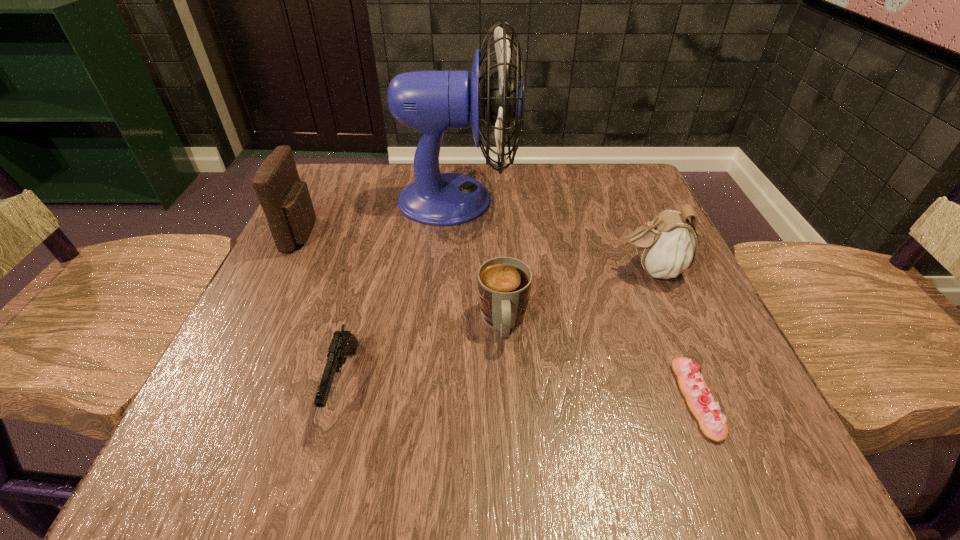
Find the location of a particular element. Image resolution: width=960 pixels, height=540 pixels. blank area at the near left corner is located at coordinates (221, 412).

Image resolution: width=960 pixels, height=540 pixels. In the image, there is a desktop. In order to click on free region at the far right corner in this screenshot , I will do `click(635, 204)`.

You are a GUI agent. You are given a task and a screenshot of the screen. Output one action in this format:
    pyautogui.click(x=<x>, y=<y>)
    Task: Click on the free space at the near right corner of the desktop
    The width and height of the screenshot is (960, 540).
    Given the screenshot: What is the action you would take?
    pyautogui.click(x=754, y=465)

The height and width of the screenshot is (540, 960). I want to click on free space between the fan and the third tallest object, so click(x=554, y=235).

Where is `free point between the tallest object and the gun`? The width and height of the screenshot is (960, 540). free point between the tallest object and the gun is located at coordinates (400, 292).

This screenshot has height=540, width=960. What are the coordinates of `empty location between the tallest object and the shortest object` in the screenshot? It's located at (577, 299).

The image size is (960, 540). What are the coordinates of `vacant region between the leftmost object and the fan` in the screenshot? It's located at (380, 217).

You are a GUI agent. You are given a task and a screenshot of the screen. Output one action in this format:
    pyautogui.click(x=<x>, y=<y>)
    Task: Click on the free spot between the fan and the eclair
    The width and height of the screenshot is (960, 540).
    Given the screenshot: What is the action you would take?
    pyautogui.click(x=577, y=299)

Locate an element on the screen. vacant area that lies between the second object from left to right and the eclair is located at coordinates (520, 391).

I want to click on empty space that is in between the taller pouch and the tallest object, so click(380, 217).